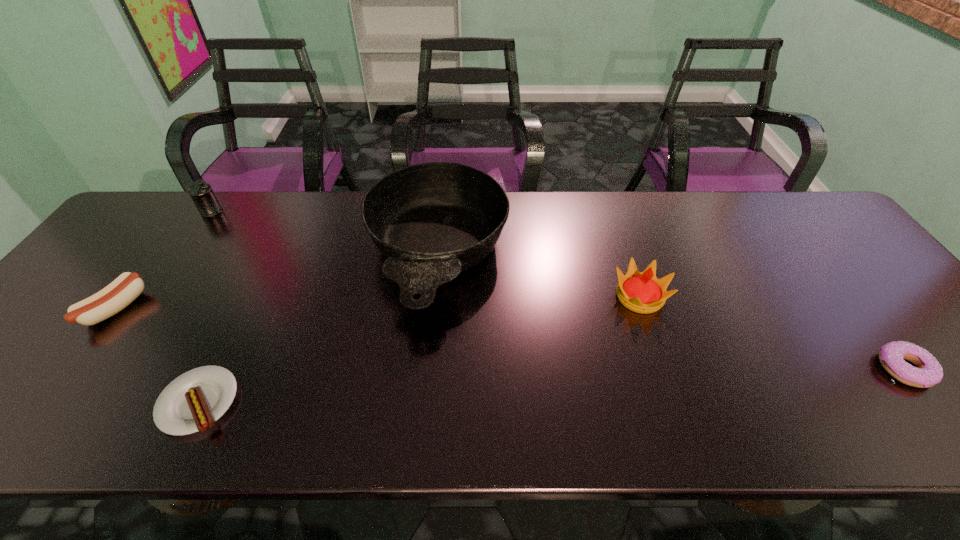
This screenshot has height=540, width=960. Identify the location of free space that is in between the crown and the fourth tallest object. (378, 302).

This screenshot has height=540, width=960. I want to click on vacant space that's between the shorter sausage and the can, so click(x=205, y=307).

At what (x,y) coordinates should I click in order to perform the action: click on blank region between the can and the left sausage. Please return your answer as a coordinate pair (x, y). The height and width of the screenshot is (540, 960). Looking at the image, I should click on (164, 260).

The width and height of the screenshot is (960, 540). I want to click on unoccupied area between the can and the taller sausage, so click(x=164, y=260).

You are a GUI agent. You are given a task and a screenshot of the screen. Output one action in this format:
    pyautogui.click(x=<x>, y=<y>)
    Task: Click on the free spot between the shorter sausage and the tallest object
    This screenshot has height=540, width=960.
    Given the screenshot: What is the action you would take?
    pyautogui.click(x=318, y=329)

The height and width of the screenshot is (540, 960). What are the coordinates of `free spot between the can and the rightmost object` in the screenshot? It's located at (558, 291).

Select which object is the third closest to the shorter sausage. Please provide its 2D coordinates. Your answer should be formatted as a tuple, i.e. [(x, y)], where the tuple contains the x and y coordinates of a point satisfying the conditions above.

[(201, 193)]

Find the location of a particular element. the fifth closest object to the can is located at coordinates (928, 372).

The height and width of the screenshot is (540, 960). Find the location of `blank space that satisfies the following two spatial constraints: 1. on the back side of the right sausage; 2. on the left side of the crown`. blank space that satisfies the following two spatial constraints: 1. on the back side of the right sausage; 2. on the left side of the crown is located at coordinates (250, 297).

Find the location of a particular element. The width and height of the screenshot is (960, 540). vacant position in the image that satisfies the following two spatial constraints: 1. with the handle extending from the side of the tallest object; 2. on the right side of the rightmost object is located at coordinates (426, 369).